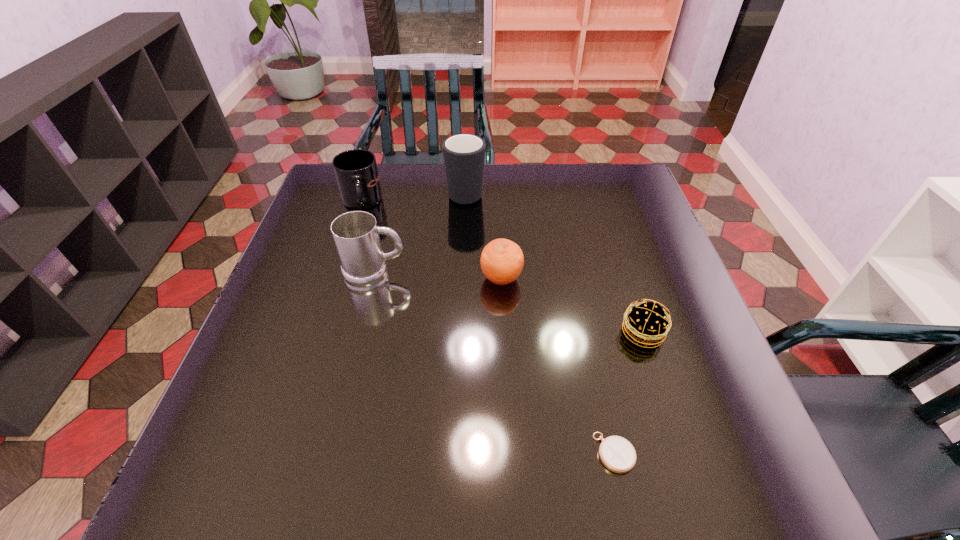
Identify which object is located as the third nearest to the shortest object. Please provide its 2D coordinates. Your answer should be formatted as a tuple, i.e. [(x, y)], where the tuple contains the x and y coordinates of a point satisfying the conditions above.

[(356, 235)]

Find the location of a particular element. The width and height of the screenshot is (960, 540). mug that is the nearest to the rightmost mug is located at coordinates click(356, 172).

I want to click on mug that is the second closest to the rightmost mug, so click(356, 235).

Image resolution: width=960 pixels, height=540 pixels. In order to click on vacant space that satisfies the following two spatial constraints: 1. on the back side of the second object from right to left; 2. on the side of the nearest mug with the handle in this screenshot , I will do `click(575, 272)`.

Identify the location of vacant region that satisfies the following two spatial constraints: 1. on the side of the nearest mug with the handle; 2. on the left side of the second object from right to left. (331, 453).

This screenshot has width=960, height=540. I want to click on vacant space that satisfies the following two spatial constraints: 1. on the back side of the patty; 2. on the right side of the compass, so click(588, 333).